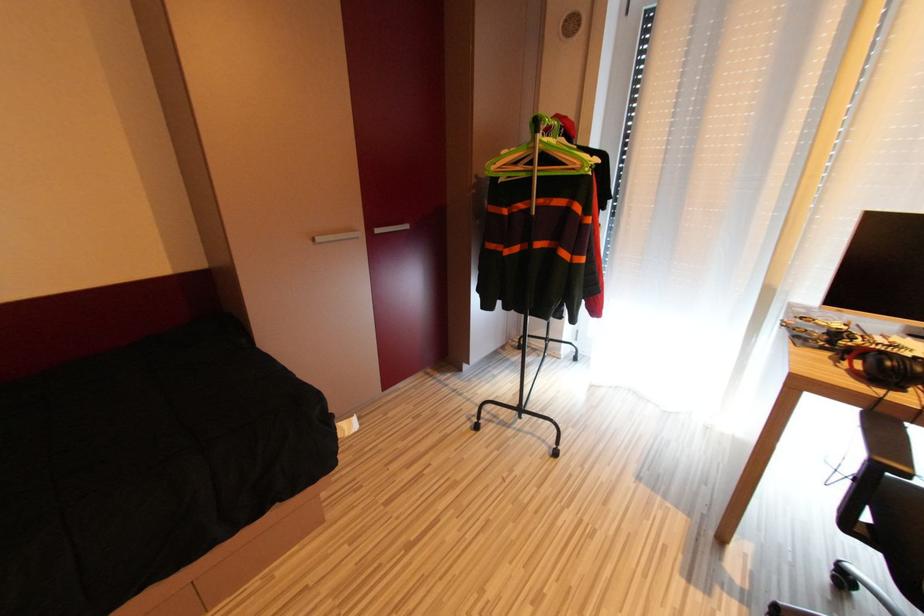
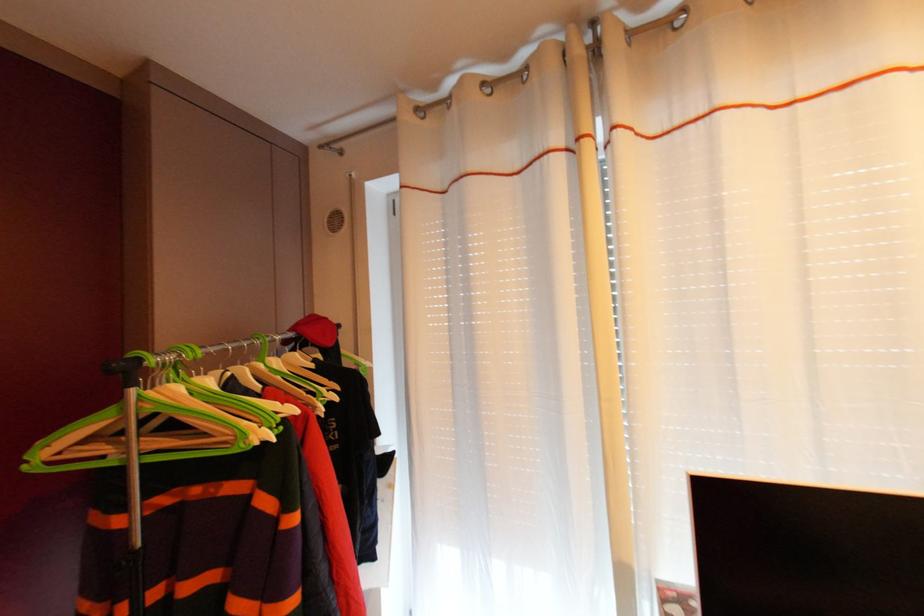
First-person continuous shooting, in which direction is the camera rotating?

The camera's rotation is toward right-up.